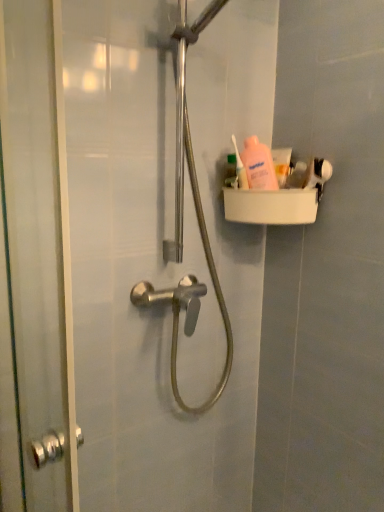
Question: From the image's perspective, is white matte toothpaste at upper right located above pink plastic bottle at upper right, the 2th toiletry from the right?

Choices:
 (A) no
 (B) yes

Answer: (A)

Question: Is pink plastic bottle at upper right, the 2th toiletry from the right, at the back of white matte toothpaste at upper right?

Choices:
 (A) no
 (B) yes

Answer: (A)

Question: From the image's perspective, does white matte toothpaste at upper right appear lower than pink plastic bottle at upper right, the 2th toiletry from the right?

Choices:
 (A) no
 (B) yes

Answer: (B)

Question: Considering the relative sizes of white matte toothpaste at upper right and pink plastic bottle at upper right, the 2th toiletry from the right, in the image provided, is white matte toothpaste at upper right wider than pink plastic bottle at upper right, the 2th toiletry from the right,?

Choices:
 (A) yes
 (B) no

Answer: (A)

Question: Does white matte toothpaste at upper right lie in front of pink plastic bottle at upper right, the 2th toiletry from the right?

Choices:
 (A) no
 (B) yes

Answer: (A)

Question: Looking at their shapes, would you say white matte toothpaste at upper right is wider or thinner than transparent glass screen door at left?

Choices:
 (A) wide
 (B) thin

Answer: (B)

Question: Would you say white matte toothpaste at upper right is inside or outside transparent glass screen door at left?

Choices:
 (A) outside
 (B) inside

Answer: (A)

Question: Would you say white matte toothpaste at upper right is to the left or to the right of transparent glass screen door at left in the picture?

Choices:
 (A) left
 (B) right

Answer: (B)

Question: In the image, is white matte toothpaste at upper right positioned in front of or behind transparent glass screen door at left?

Choices:
 (A) front
 (B) behind

Answer: (B)

Question: Considering their positions, is pink matte lotion at upper right, acting as the 1th toiletry starting from the right, located in front of or behind white matte toothpaste at upper right?

Choices:
 (A) front
 (B) behind

Answer: (A)

Question: From a real-world perspective, is pink matte lotion at upper right, which is the 2th toiletry in left-to-right order, above or below white matte toothpaste at upper right?

Choices:
 (A) above
 (B) below

Answer: (B)

Question: In terms of width, does pink matte lotion at upper right, acting as the 1th toiletry starting from the right, look wider or thinner when compared to white matte toothpaste at upper right?

Choices:
 (A) thin
 (B) wide

Answer: (A)

Question: In terms of height, does pink matte lotion at upper right, acting as the 1th toiletry starting from the right, look taller or shorter compared to white matte toothpaste at upper right?

Choices:
 (A) short
 (B) tall

Answer: (A)

Question: Looking at their shapes, would you say white matte toothpaste at upper right is wider or thinner than pink matte lotion at upper right, acting as the 1th toiletry starting from the right?

Choices:
 (A) thin
 (B) wide

Answer: (B)

Question: From a real-world perspective, relative to pink matte lotion at upper right, which is the 2th toiletry in left-to-right order, is white matte toothpaste at upper right vertically above or below?

Choices:
 (A) above
 (B) below

Answer: (A)